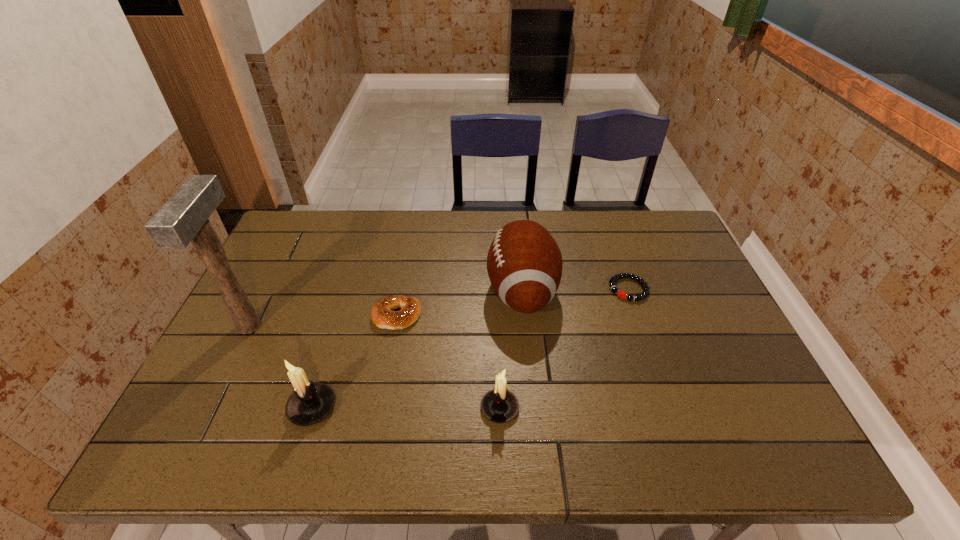
Locate an element on the screen. The image size is (960, 540). vacant region that satisfies the following two spatial constraints: 1. on the front side of the fourth shortest object; 2. on the left side of the leftmost object is located at coordinates [209, 407].